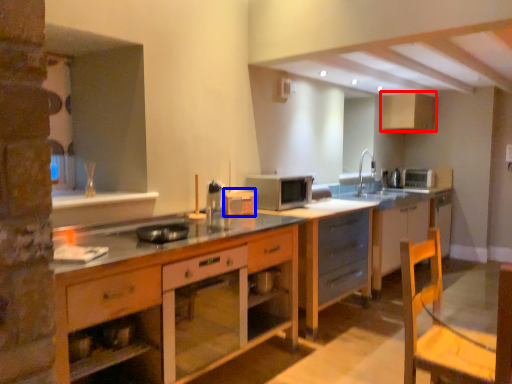
Question: Among these objects, which one is farthest to the camera, cabinetry (highlighted by a red box) or appliance (highlighted by a blue box)?

Choices:
 (A) cabinetry
 (B) appliance

Answer: (A)